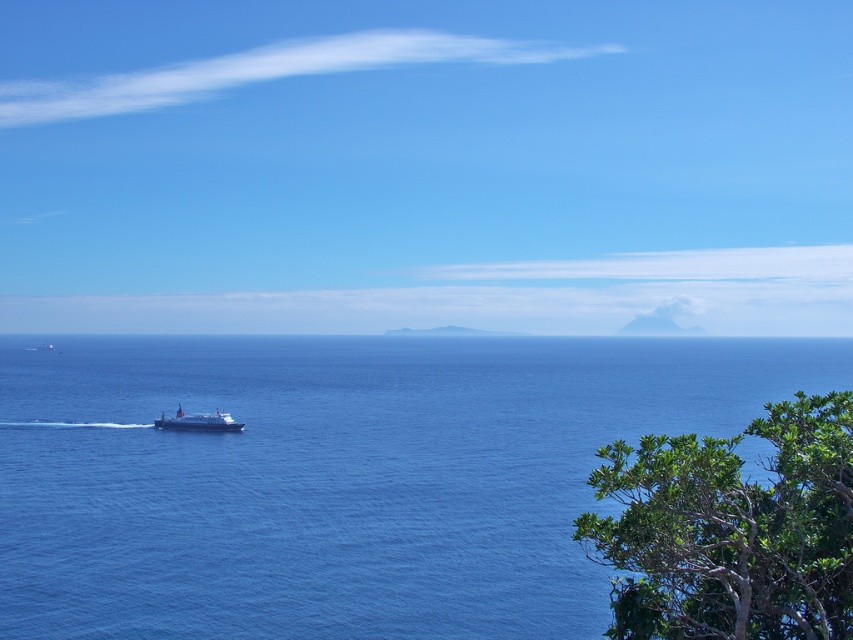
Which is more to the left, blue liquid water at center or white glossy ferry at center?

From the viewer's perspective, white glossy ferry at center appears more on the left side.

Is blue liquid water at center thinner than white glossy ferry at center?

In fact, blue liquid water at center might be wider than white glossy ferry at center.

I want to click on blue liquid water at center, so click(341, 476).

Identify the location of blue liquid water at center. The width and height of the screenshot is (853, 640). (341, 476).

Can you confirm if blue liquid water at center is smaller than green leafy tree at lower right?

No, blue liquid water at center is not smaller than green leafy tree at lower right.

Does point (148, 500) come in front of point (729, 576)?

No, (148, 500) is behind (729, 576).

The height and width of the screenshot is (640, 853). I want to click on blue liquid water at center, so click(x=341, y=476).

Who is shorter, green leafy tree at lower right or white glossy ferry at center?

With less height is white glossy ferry at center.

Which is in front, point (780, 413) or point (204, 426)?

Point (780, 413)

This screenshot has height=640, width=853. Identify the location of green leafy tree at lower right. (730, 529).